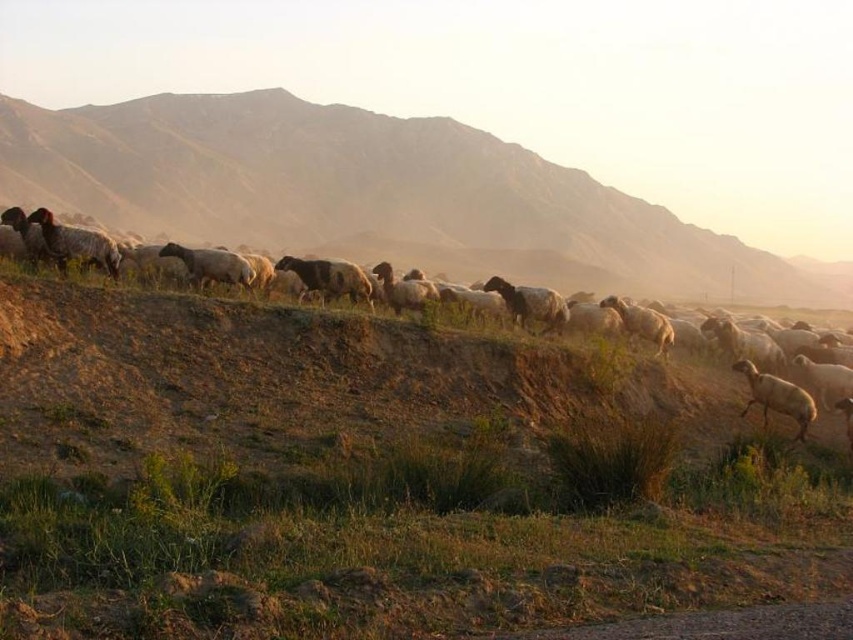
Can you confirm if green grassy at lower center is thinner than white woolly sheep at center?

Yes, green grassy at lower center is thinner than white woolly sheep at center.

Is the position of green grassy at lower center more distant than that of white woolly sheep at center?

No, green grassy at lower center is closer to the viewer.

Consider the image. Measure the distance between green grassy at lower center and camera.

green grassy at lower center and camera are 19.45 feet apart from each other.

Find the location of a particular element. green grassy at lower center is located at coordinates (401, 556).

Does brown grassy hillside at center appear on the right side of white woolly sheep at center-right?

No, brown grassy hillside at center is not to the right of white woolly sheep at center-right.

Locate an element on the screen. The width and height of the screenshot is (853, 640). brown grassy hillside at center is located at coordinates (368, 192).

Does green grassy at lower center have a greater width compared to brown grassy hillside at center?

In fact, green grassy at lower center might be narrower than brown grassy hillside at center.

What do you see at coordinates (401, 556) in the screenshot? The image size is (853, 640). I see `green grassy at lower center` at bounding box center [401, 556].

At what (x,y) coordinates should I click in order to perform the action: click on green grassy at lower center. Please return your answer as a coordinate pair (x, y). The image size is (853, 640). Looking at the image, I should click on (401, 556).